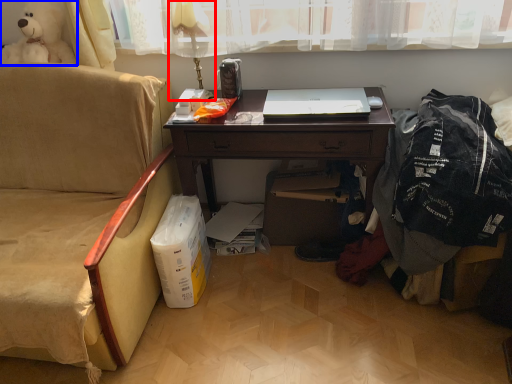
Question: Among these objects, which one is nearest to the camera, table lamp (highlighted by a red box) or toy (highlighted by a blue box)?

Choices:
 (A) table lamp
 (B) toy

Answer: (A)